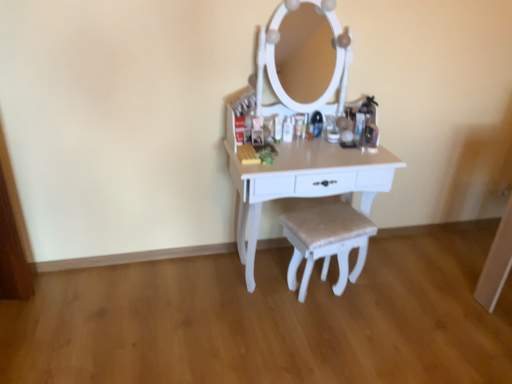
In order to face white painted wood table at center, should I rotate leftwards or rightwards?

It's best to rotate right around 6.685 degrees.

Identify the location of white painted wood table at center. The width and height of the screenshot is (512, 384). (305, 183).

The width and height of the screenshot is (512, 384). What do you see at coordinates (305, 183) in the screenshot? I see `white painted wood table at center` at bounding box center [305, 183].

Locate an element on the screen. The image size is (512, 384). beige fabric stool at center is located at coordinates (326, 242).

Image resolution: width=512 pixels, height=384 pixels. Describe the element at coordinates (326, 242) in the screenshot. I see `beige fabric stool at center` at that location.

The height and width of the screenshot is (384, 512). I want to click on white painted wood table at center, so click(x=305, y=183).

Is beige fabric stool at center at the right side of white painted wood table at center?

Correct, you'll find beige fabric stool at center to the right of white painted wood table at center.

From the picture: Is beige fabric stool at center further to the viewer compared to white painted wood table at center?

Yes, beige fabric stool at center is behind white painted wood table at center.

Does point (315, 258) appear closer or farther from the camera than point (373, 185)?

Point (315, 258).

From the image's perspective, relative to white painted wood table at center, is beige fabric stool at center above or below?

From the image's perspective, beige fabric stool at center appears below white painted wood table at center.

From a real-world perspective, is beige fabric stool at center located higher than white painted wood table at center?

Incorrect, from a real-world perspective, beige fabric stool at center is lower than white painted wood table at center.

Does beige fabric stool at center have a lesser width compared to white painted wood table at center?

Indeed, beige fabric stool at center has a lesser width compared to white painted wood table at center.

Considering the relative sizes of beige fabric stool at center and white painted wood table at center in the image provided, is beige fabric stool at center taller than white painted wood table at center?

No, beige fabric stool at center is not taller than white painted wood table at center.

Considering the sizes of objects beige fabric stool at center and white painted wood table at center in the image provided, who is bigger, beige fabric stool at center or white painted wood table at center?

With larger size is white painted wood table at center.

Would you say white painted wood table at center is part of beige fabric stool at center's contents?

No, white painted wood table at center is not inside beige fabric stool at center.

Are beige fabric stool at center and white painted wood table at center making contact?

No, beige fabric stool at center is not next to white painted wood table at center.

Is beige fabric stool at center positioned with its back to white painted wood table at center?

That's right, beige fabric stool at center is facing away from white painted wood table at center.

What's the angular difference between beige fabric stool at center and white painted wood table at center's facing directions?

The facing directions of beige fabric stool at center and white painted wood table at center are 14.4 degrees apart.

Where is `step stool located behind the white painted wood table at center`? The width and height of the screenshot is (512, 384). step stool located behind the white painted wood table at center is located at coordinates (326, 242).

From the picture: Is white painted wood table at center to the right of beige fabric stool at center from the viewer's perspective?

No, white painted wood table at center is not to the right of beige fabric stool at center.

Relative to beige fabric stool at center, is white painted wood table at center in front or behind?

Clearly, white painted wood table at center is in front of beige fabric stool at center.

Which is further, (315, 188) or (319, 231)?

The point (319, 231) is farther.

From the image's perspective, is white painted wood table at center under beige fabric stool at center?

Actually, white painted wood table at center appears above beige fabric stool at center in the image.

From a real-world perspective, which object rests below the other?

From a 3D spatial view, beige fabric stool at center is below.

Is white painted wood table at center wider than beige fabric stool at center?

Yes, white painted wood table at center is wider than beige fabric stool at center.

Considering the relative sizes of white painted wood table at center and beige fabric stool at center in the image provided, is white painted wood table at center taller than beige fabric stool at center?

Yes, white painted wood table at center is taller than beige fabric stool at center.

Considering the sizes of objects white painted wood table at center and beige fabric stool at center in the image provided, who is bigger, white painted wood table at center or beige fabric stool at center?

white painted wood table at center is bigger.

Based on the photo, is white painted wood table at center located outside beige fabric stool at center?

white painted wood table at center is positioned outside beige fabric stool at center.

Is white painted wood table at center beside beige fabric stool at center?

white painted wood table at center and beige fabric stool at center are not in contact.

Could you tell me if white painted wood table at center is turned towards beige fabric stool at center?

Yes, white painted wood table at center is facing beige fabric stool at center.

Where is `table to the left of beige fabric stool at center`? The height and width of the screenshot is (384, 512). table to the left of beige fabric stool at center is located at coordinates (305, 183).

Where is `table above the beige fabric stool at center (from a real-world perspective)`? The height and width of the screenshot is (384, 512). table above the beige fabric stool at center (from a real-world perspective) is located at coordinates (305, 183).

Identify the location of table above the beige fabric stool at center (from the image's perspective). Image resolution: width=512 pixels, height=384 pixels. coord(305,183).